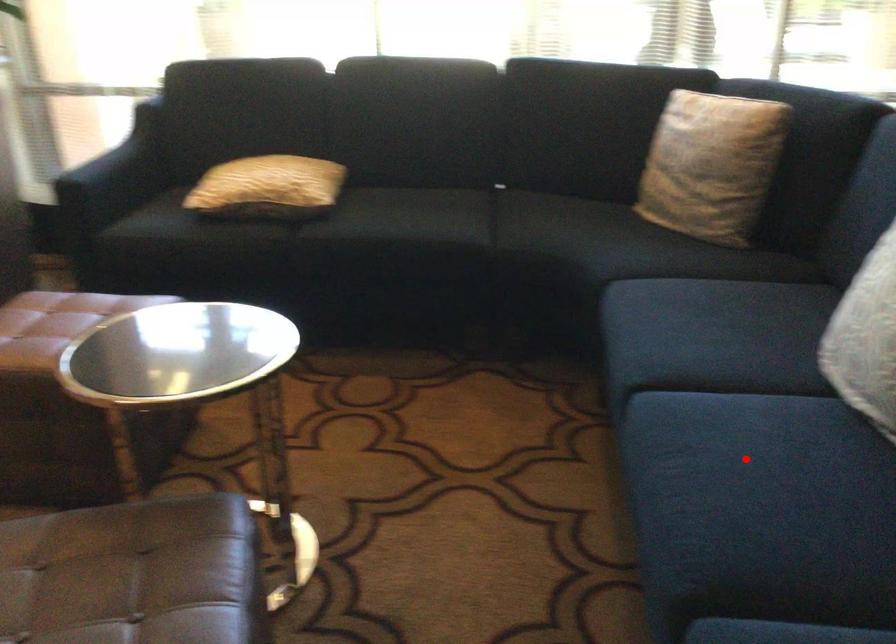
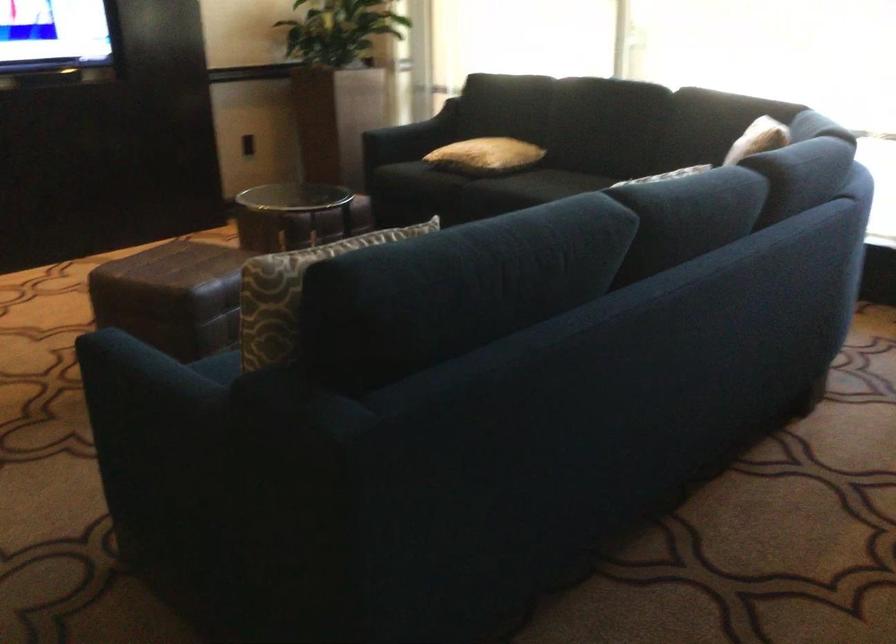
Question: I am providing you with two images of the same scene from different viewpoints. A red point is marked on the first image. At the location where the point appears in image 1, is it still visible in image 2?

Choices:
 (A) Yes
 (B) No

Answer: (B)